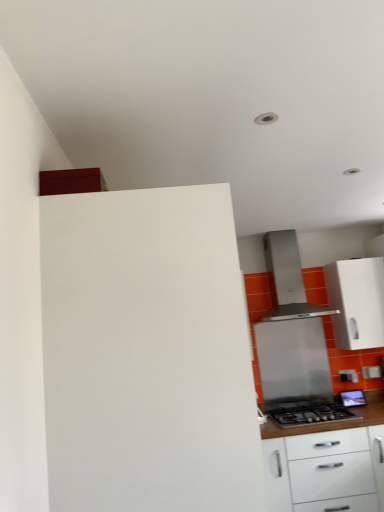
Question: Considering the relative sizes of white glossy cabinet at lower right, which appears as the 2th cabinetry when viewed from the left, and white glossy cabinet at right, acting as the first cabinetry starting from the right, in the image provided, is white glossy cabinet at lower right, which appears as the 2th cabinetry when viewed from the left, bigger than white glossy cabinet at right, acting as the first cabinetry starting from the right,?

Choices:
 (A) no
 (B) yes

Answer: (B)

Question: Would you say white glossy cabinet at right, the third cabinetry positioned from the left, is part of white glossy cabinet at lower right, which is the 2th cabinetry in right-to-left order,'s contents?

Choices:
 (A) yes
 (B) no

Answer: (B)

Question: Is white glossy cabinet at lower right, which is the 2th cabinetry in right-to-left order, completely or partially outside of white glossy cabinet at right, acting as the first cabinetry starting from the right?

Choices:
 (A) no
 (B) yes

Answer: (B)

Question: Is white glossy cabinet at lower right, which appears as the 2th cabinetry when viewed from the left, positioned before white glossy cabinet at right, acting as the first cabinetry starting from the right?

Choices:
 (A) no
 (B) yes

Answer: (B)

Question: Does white glossy cabinet at lower right, which appears as the 2th cabinetry when viewed from the front, appear on the left side of white glossy cabinet at right, the third cabinetry positioned from the left?

Choices:
 (A) no
 (B) yes

Answer: (B)

Question: Looking at their shapes, would you say white matte cabinet at upper left, which ranks as the 3th cabinetry in back-to-front order, is wider or thinner than white glossy cabinet at lower right, which is the 2th cabinetry in right-to-left order?

Choices:
 (A) wide
 (B) thin

Answer: (B)

Question: Considering the relative positions of white matte cabinet at upper left, which is the 3th cabinetry in right-to-left order, and white glossy cabinet at lower right, which appears as the 2th cabinetry when viewed from the front, in the image provided, is white matte cabinet at upper left, which is the 3th cabinetry in right-to-left order, to the left or to the right of white glossy cabinet at lower right, which appears as the 2th cabinetry when viewed from the front,?

Choices:
 (A) left
 (B) right

Answer: (A)

Question: From a real-world perspective, relative to white glossy cabinet at lower right, which appears as the 2th cabinetry when viewed from the front, is white matte cabinet at upper left, which is the 3th cabinetry in right-to-left order, vertically above or below?

Choices:
 (A) below
 (B) above

Answer: (B)

Question: From the image's perspective, is white matte cabinet at upper left, which is counted as the first cabinetry, starting from the left, positioned above or below white glossy cabinet at lower right, which appears as the 2th cabinetry when viewed from the left?

Choices:
 (A) below
 (B) above

Answer: (B)

Question: Based on their sizes in the image, would you say stainless steel range hood at center is bigger or smaller than stainless steel gas stove at lower right?

Choices:
 (A) big
 (B) small

Answer: (A)

Question: In terms of width, does stainless steel range hood at center look wider or thinner when compared to stainless steel gas stove at lower right?

Choices:
 (A) thin
 (B) wide

Answer: (A)

Question: In terms of height, does stainless steel range hood at center look taller or shorter compared to stainless steel gas stove at lower right?

Choices:
 (A) tall
 (B) short

Answer: (A)

Question: In the image, is stainless steel range hood at center positioned in front of or behind stainless steel gas stove at lower right?

Choices:
 (A) behind
 (B) front

Answer: (A)

Question: Is stainless steel range hood at center taller or shorter than white glossy cabinet at lower right, which is the 2th cabinetry in right-to-left order?

Choices:
 (A) short
 (B) tall

Answer: (A)

Question: Would you say stainless steel range hood at center is to the left or to the right of white glossy cabinet at lower right, which is the 2th cabinetry in right-to-left order, in the picture?

Choices:
 (A) left
 (B) right

Answer: (A)